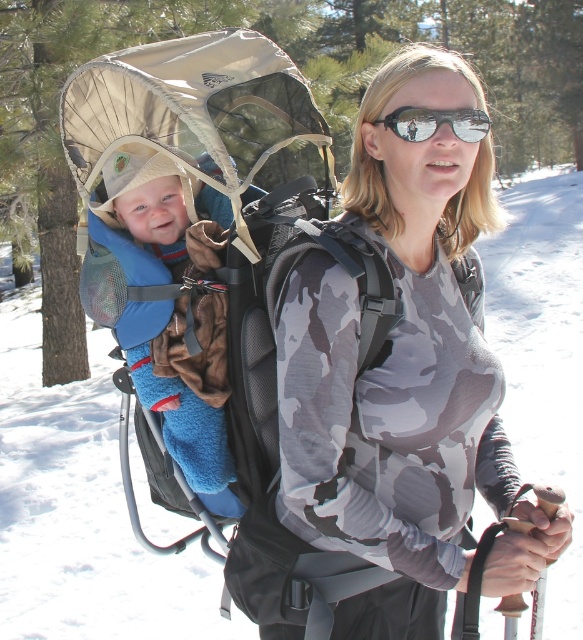
Looking at this image, is camouflage fabric shirt at center above sunglasses at center?

No.

Is point (381, 480) in front of point (385, 122)?

No, (381, 480) is behind (385, 122).

Between point (287, 422) and point (475, 140), which one is positioned in front?

Point (287, 422) is in front.

The width and height of the screenshot is (583, 640). Find the location of `camouflage fabric shirt at center`. camouflage fabric shirt at center is located at coordinates (398, 365).